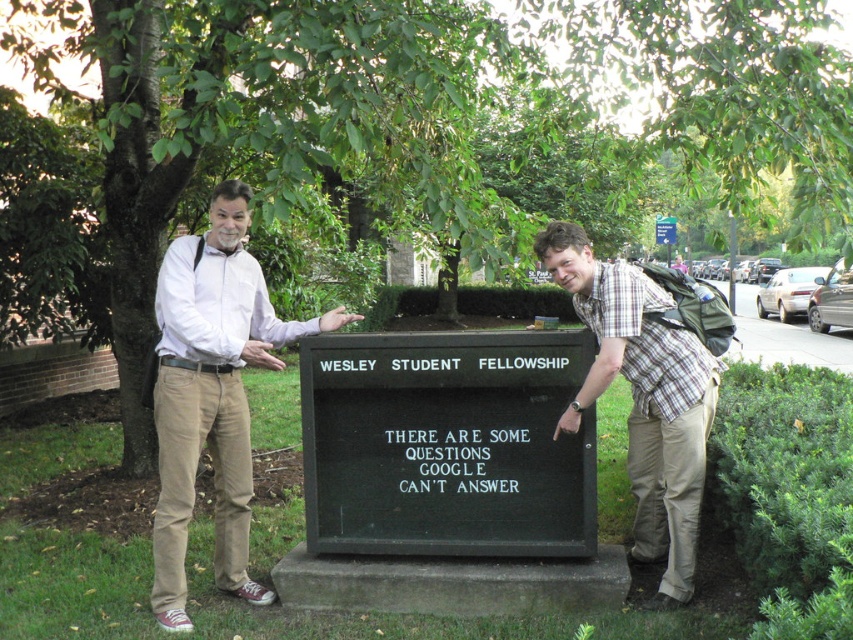
Does light brown pants at left appear on the left side of plaid shirt at right?

Indeed, light brown pants at left is positioned on the left side of plaid shirt at right.

Is light brown pants at left thinner than plaid shirt at right?

Incorrect, light brown pants at left's width is not less than plaid shirt at right's.

Is point (163, 355) positioned before point (633, 401)?

Yes, point (163, 355) is closer to viewer.

Locate an element on the screen. The width and height of the screenshot is (853, 640). light brown pants at left is located at coordinates (212, 394).

Is point (474, 554) closer to viewer compared to point (637, 374)?

No, (474, 554) is further to viewer.

Image resolution: width=853 pixels, height=640 pixels. Describe the element at coordinates (447, 444) in the screenshot. I see `black matte sign at center` at that location.

The image size is (853, 640). In order to click on black matte sign at center in this screenshot , I will do `click(447, 444)`.

Is black matte sign at center wider than light brown pants at left?

Correct, the width of black matte sign at center exceeds that of light brown pants at left.

Is black matte sign at center closer to the viewer compared to light brown pants at left?

No.

Does point (558, 445) come behind point (260, 356)?

Yes, point (558, 445) is behind point (260, 356).

Identify the location of black matte sign at center. Image resolution: width=853 pixels, height=640 pixels. (447, 444).